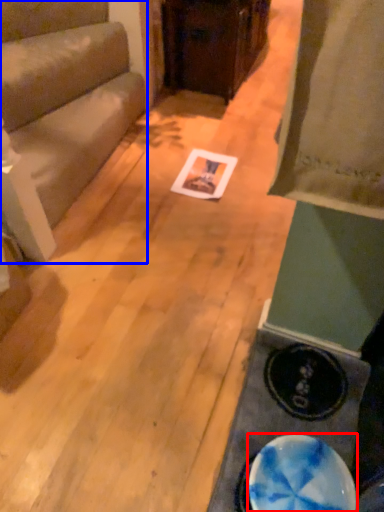
Question: Which object appears closest to the camera in this image, plate (highlighted by a red box) or furniture (highlighted by a blue box)?

Choices:
 (A) plate
 (B) furniture

Answer: (A)